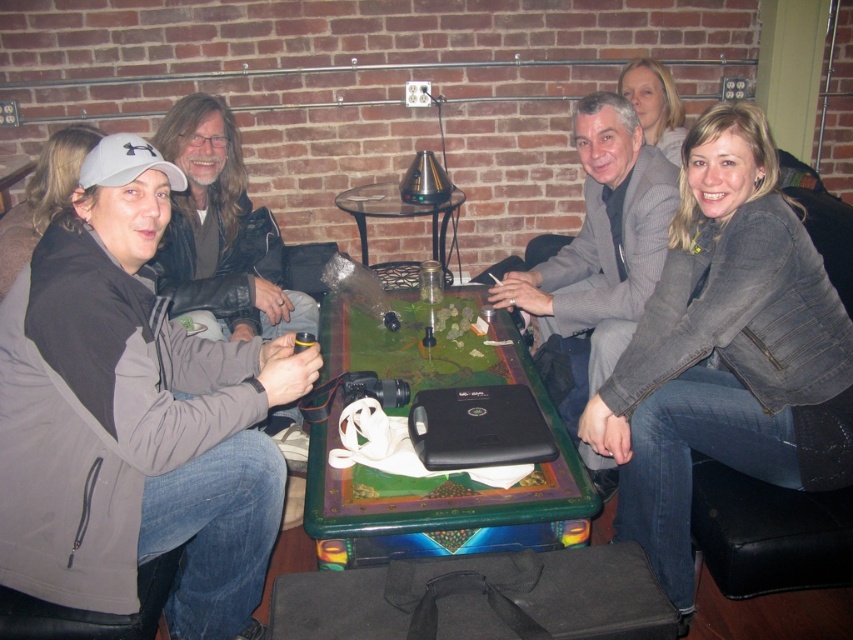
Question: Does denim jacket at lower right have a larger size compared to gray textured suit at center?

Choices:
 (A) yes
 (B) no

Answer: (B)

Question: Among these objects, which one is nearest to the camera?

Choices:
 (A) denim jacket at lower right
 (B) translucent glass table at center
 (C) matte gray cap at left

Answer: (C)

Question: Does denim jacket at lower right lie in front of gray textured suit at center?

Choices:
 (A) no
 (B) yes

Answer: (B)

Question: Which point is closer to the camera?

Choices:
 (A) (9, 440)
 (B) (21, 205)
 (C) (355, 204)
 (D) (688, 161)

Answer: (A)

Question: Which is farther from the matte gray cap at left?

Choices:
 (A) blonde hair at upper right
 (B) gray matte jacket at left
 (C) denim jacket at lower right

Answer: (A)

Question: Is denim jacket at lower right to the left of green glossy table at center from the viewer's perspective?

Choices:
 (A) yes
 (B) no

Answer: (B)